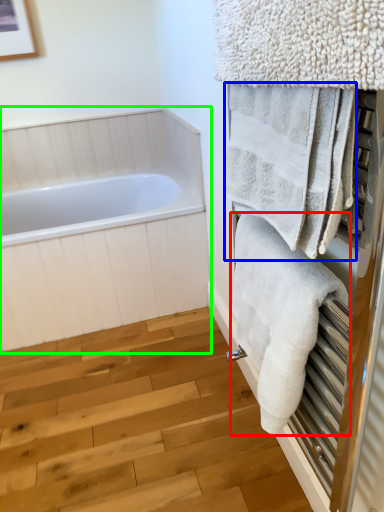
Question: Based on their relative distances, which object is nearer to towel (highlighted by a red box)? Choose from towel (highlighted by a blue box) and bathtub (highlighted by a green box).

Choices:
 (A) towel
 (B) bathtub

Answer: (A)